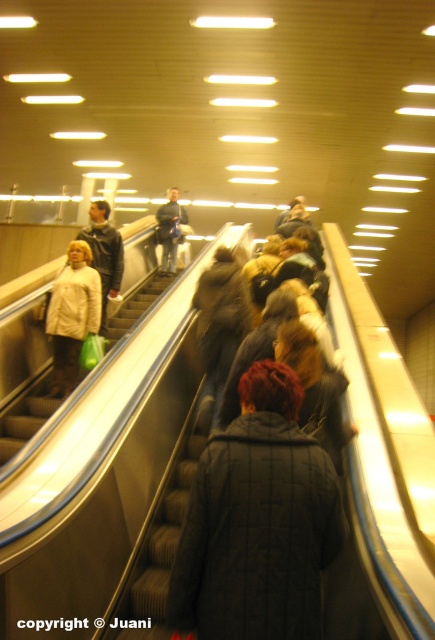
Question: Based on their relative distances, which object is farther from the dark gray jacket at center?

Choices:
 (A) dark gray quilted coat at center
 (B) beige quilted coat at center

Answer: (A)

Question: Can you confirm if dark gray quilted coat at center is positioned below matte black jacket at left?

Choices:
 (A) no
 (B) yes

Answer: (B)

Question: Which point is closer to the camera?

Choices:
 (A) dark gray jacket at center
 (B) dark gray quilted coat at center

Answer: (B)

Question: Is dark gray quilted coat at center bigger than beige quilted coat at center?

Choices:
 (A) yes
 (B) no

Answer: (B)

Question: Estimate the real-world distances between objects in this image. Which object is farther from the matte black jacket at left?

Choices:
 (A) dark gray jacket at center
 (B) beige quilted coat at center
 (C) dark gray quilted coat at center

Answer: (C)

Question: Observing the image, what is the correct spatial positioning of beige quilted coat at center in reference to matte black jacket at left?

Choices:
 (A) left
 (B) right

Answer: (A)